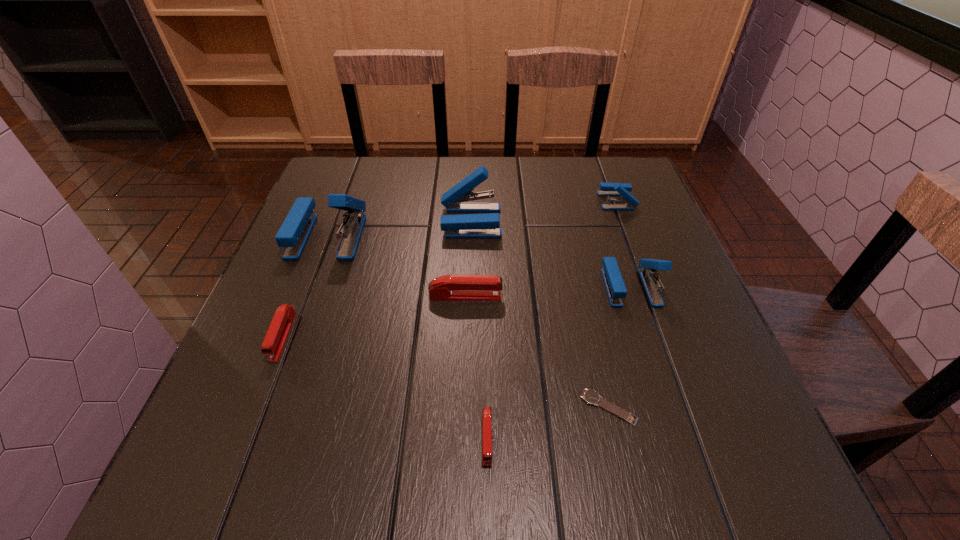
Where is `vacant region at the far right corner`? The image size is (960, 540). vacant region at the far right corner is located at coordinates (617, 175).

In the image, there is a desktop. Where is `vacant space at the near right corner`? Image resolution: width=960 pixels, height=540 pixels. vacant space at the near right corner is located at coordinates (686, 472).

Where is `vacant area between the second tallest object and the sixth shortest object`? vacant area between the second tallest object and the sixth shortest object is located at coordinates (551, 254).

The width and height of the screenshot is (960, 540). Find the location of `vacant space that is in between the third shortest stapler and the second tallest stapler`. vacant space that is in between the third shortest stapler and the second tallest stapler is located at coordinates (468, 259).

Identify the location of free spot between the smallest blue stapler and the second nearest stapler. (449, 268).

This screenshot has width=960, height=540. I want to click on blank region between the third tallest object and the third shortest object, so click(457, 312).

Locate an element on the screen. free point between the shortest stapler and the leftmost blue stapler is located at coordinates (407, 337).

The width and height of the screenshot is (960, 540). Find the location of `blank region between the nearest blue stapler and the seventh tallest object`. blank region between the nearest blue stapler and the seventh tallest object is located at coordinates (559, 362).

Identify the location of free area in between the fourth tallest stapler and the sixth farthest stapler. The image size is (960, 540). (449, 268).

At what (x,y) coordinates should I click in order to perform the action: click on unoccupied position between the watch and the shortest stapler. Please return your answer as a coordinate pair (x, y). The width and height of the screenshot is (960, 540). Looking at the image, I should click on (548, 423).